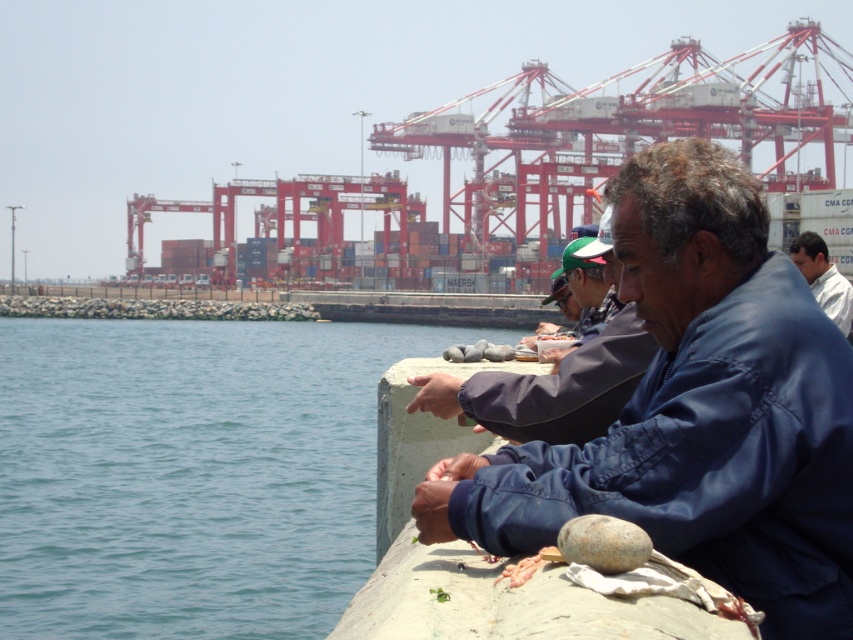
Question: Which is nearer to the white cotton shirt at right?

Choices:
 (A) blue water at lower left
 (B) blue fabric jacket at center

Answer: (B)

Question: Which point is farther to the camera?

Choices:
 (A) (178, 480)
 (B) (805, 252)
 (C) (764, 464)

Answer: (A)

Question: Is blue water at lower left to the right of white cotton shirt at right from the viewer's perspective?

Choices:
 (A) no
 (B) yes

Answer: (A)

Question: Is blue fabric jacket at center thinner than white cotton shirt at right?

Choices:
 (A) no
 (B) yes

Answer: (B)

Question: Among these points, which one is nearest to the camera?

Choices:
 (A) (387, 330)
 (B) (811, 248)

Answer: (B)

Question: Is blue fabric jacket at center wider than white cotton shirt at right?

Choices:
 (A) yes
 (B) no

Answer: (B)